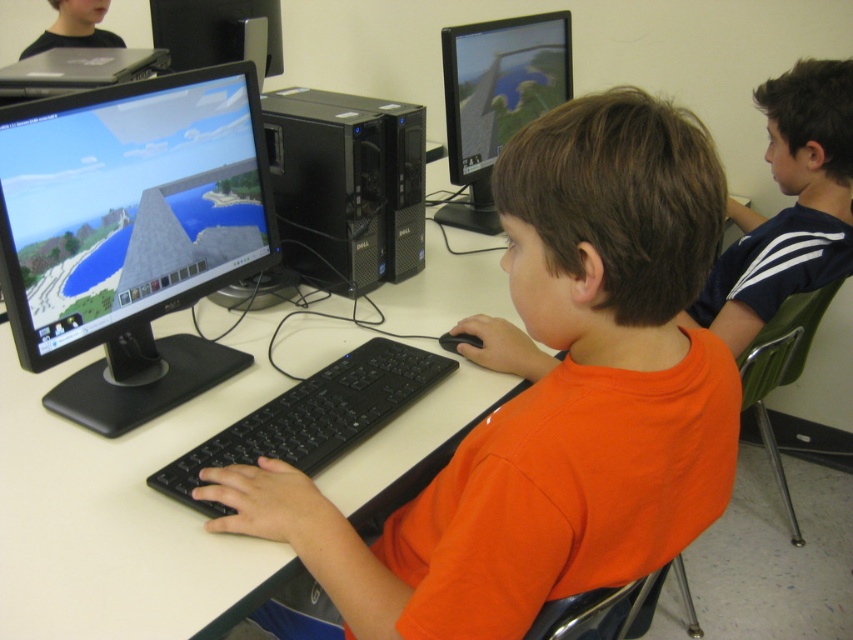
From the picture: You are standing in the classroom and need to locate the black plastic monitor at center. According to the coordinates provided, where would you find it?

The black plastic monitor at center is located at point coordinates of 0.367 on the x axis and 0.154 on the y axis.

You are a teacher trying to set up a dual monitor setup for a student workstation. You have two monitors available, the black plastic monitor at center and the matte black monitor at center. Which monitor should you place on the left side to ensure it doesn not block the student s view of the smaller monitor?

The black plastic monitor at center is larger in size than the matte black monitor at center, so placing the matte black monitor at center on the left side will prevent it from blocking the view of the larger monitor.

From the picture: You are a teacher observing the classroom. You notice the orange matte shirt at center and the white matte table at center. From your perspective, which object is positioned to the right?

The orange matte shirt at center is to the right of the white matte table at center.